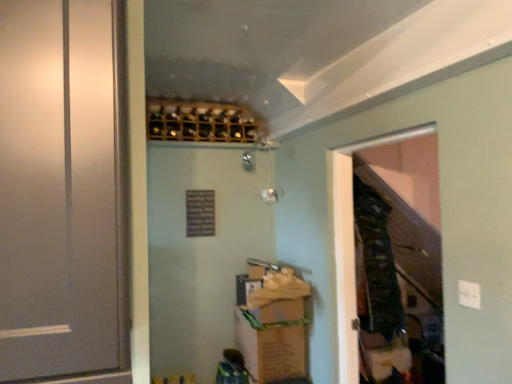
Question: Is wooden screen door at right positioned before wooden wine rack at upper center?

Choices:
 (A) no
 (B) yes

Answer: (B)

Question: From a real-world perspective, does wooden screen door at right sit lower than wooden wine rack at upper center?

Choices:
 (A) no
 (B) yes

Answer: (B)

Question: Is wooden screen door at right further to camera compared to wooden wine rack at upper center?

Choices:
 (A) yes
 (B) no

Answer: (B)

Question: Is wooden screen door at right at the left side of wooden wine rack at upper center?

Choices:
 (A) no
 (B) yes

Answer: (A)

Question: Is wooden screen door at right outside of wooden wine rack at upper center?

Choices:
 (A) no
 (B) yes

Answer: (B)

Question: From a real-world perspective, is wooden screen door at right positioned above or below white matte door at left?

Choices:
 (A) above
 (B) below

Answer: (B)

Question: Considering their positions, is wooden screen door at right located in front of or behind white matte door at left?

Choices:
 (A) behind
 (B) front

Answer: (A)

Question: Is wooden screen door at right wider or thinner than white matte door at left?

Choices:
 (A) thin
 (B) wide

Answer: (A)

Question: Is wooden screen door at right inside or outside of white matte door at left?

Choices:
 (A) outside
 (B) inside

Answer: (A)

Question: Choose the correct answer: Is brown cardboard box at lower center inside wooden screen door at right or outside it?

Choices:
 (A) inside
 (B) outside

Answer: (B)

Question: From a real-world perspective, is brown cardboard box at lower center physically located above or below wooden screen door at right?

Choices:
 (A) below
 (B) above

Answer: (A)

Question: Looking at the image, does brown cardboard box at lower center seem bigger or smaller compared to wooden screen door at right?

Choices:
 (A) small
 (B) big

Answer: (B)

Question: Considering their positions, is brown cardboard box at lower center located in front of or behind wooden screen door at right?

Choices:
 (A) front
 (B) behind

Answer: (B)

Question: Looking at their shapes, would you say white matte door at left is wider or thinner than brown cardboard box at lower center?

Choices:
 (A) thin
 (B) wide

Answer: (A)

Question: From the image's perspective, is white matte door at left above or below brown cardboard box at lower center?

Choices:
 (A) above
 (B) below

Answer: (A)